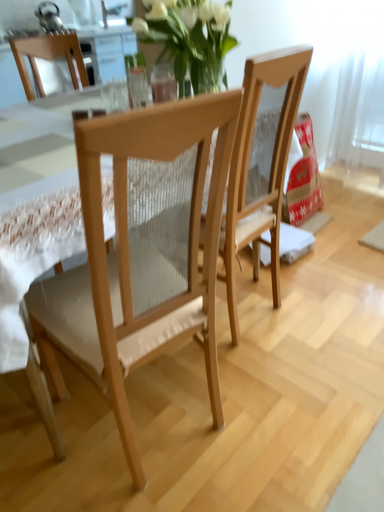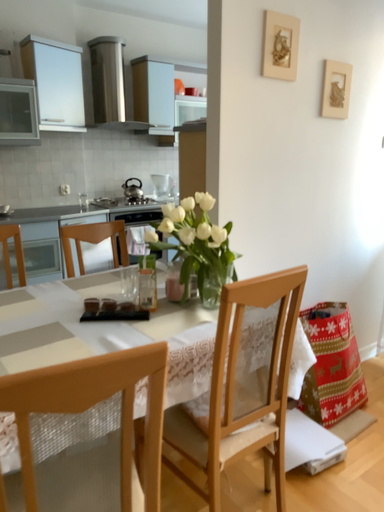
Question: How did the camera likely rotate when shooting the video?

Choices:
 (A) rotated right
 (B) rotated left

Answer: (B)